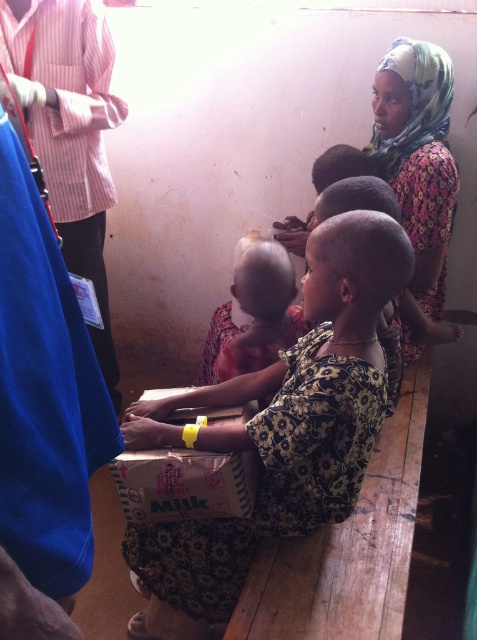
Question: Which of the following is the farthest from the observer?

Choices:
 (A) (412, 92)
 (B) (211, 568)
 (C) (412, 529)
 (D) (245, 260)

Answer: (A)

Question: Which point is farther to the camera?

Choices:
 (A) (386, 493)
 (B) (384, 90)
 (C) (332, 266)

Answer: (B)

Question: Does wooden bench at lower center appear on the right side of smooth skin baby at center?

Choices:
 (A) yes
 (B) no

Answer: (A)

Question: Which of these objects is positioned closest to the floral fabric dress at center?

Choices:
 (A) smooth skin baby at center
 (B) wooden bench at lower center

Answer: (B)

Question: Can you confirm if floral fabric dress at center is positioned to the left of floral fabric headscarf at upper right?

Choices:
 (A) no
 (B) yes

Answer: (B)

Question: Is the position of floral fabric dress at center less distant than that of smooth skin baby at center?

Choices:
 (A) yes
 (B) no

Answer: (A)